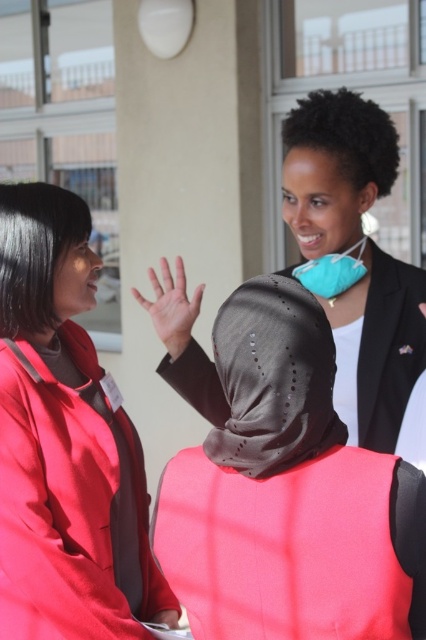
Question: Among these points, which one is farthest from the camera?

Choices:
 (A) (365, 108)
 (B) (5, 536)
 (C) (284, 284)
 (D) (181, 289)

Answer: (D)

Question: Which object is farther from the camera taking this photo?

Choices:
 (A) matte red jacket at left
 (B) black matte shawl at center
 (C) smooth skin hand at center

Answer: (C)

Question: Among these points, which one is nearest to the camera?

Choices:
 (A) (374, 260)
 (B) (293, 419)
 (C) (58, 616)
 (D) (181, 316)

Answer: (B)

Question: Is matte black hijab at center to the left of smooth skin hand at center from the viewer's perspective?

Choices:
 (A) no
 (B) yes

Answer: (A)

Question: Does matte black hijab at center have a smaller size compared to smooth skin hand at center?

Choices:
 (A) no
 (B) yes

Answer: (A)

Question: Can you confirm if matte red jacket at left is positioned above matte black hijab at center?

Choices:
 (A) yes
 (B) no

Answer: (B)